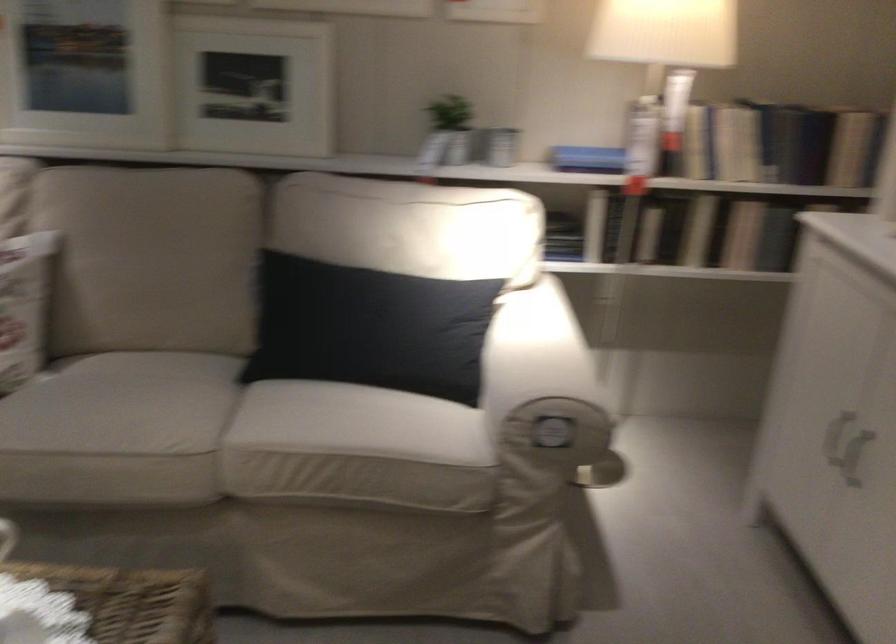
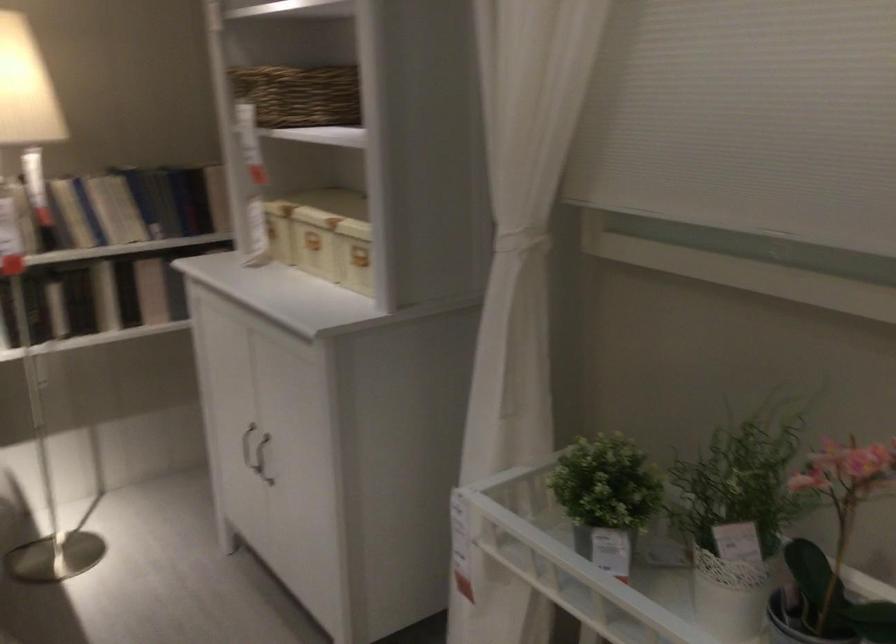
Locate, in the second image, the point that corresponds to the point at 705,223 in the first image.

(105, 296)